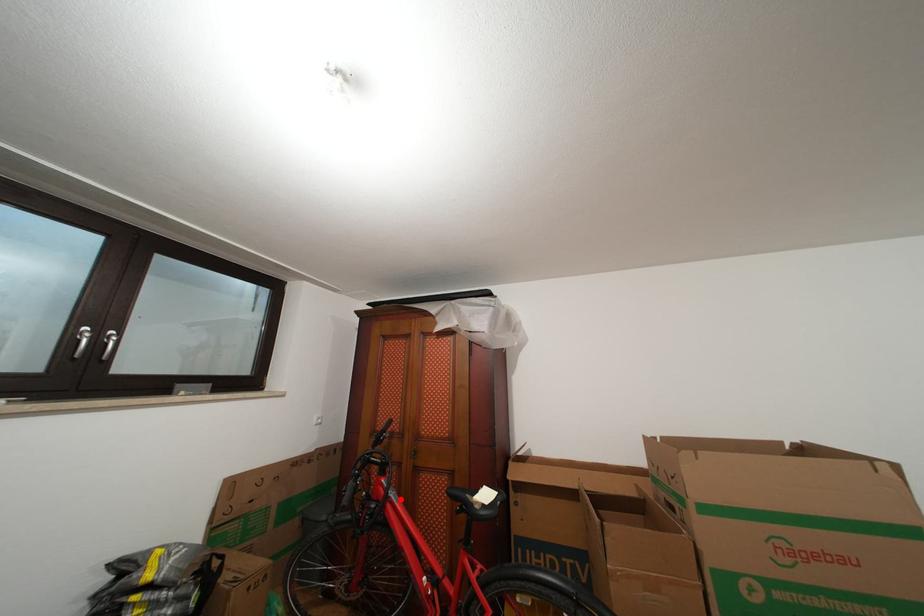
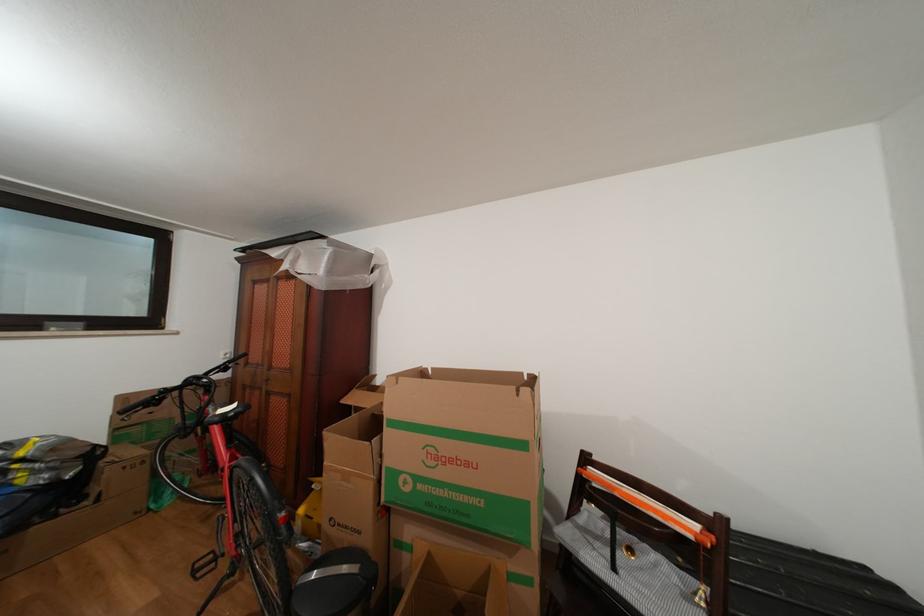
Question: I am providing you with two images of the same scene from different viewpoints. Image1 has a red point marked. In image2, the corresponding 3D location appears at what relative position? Reply with the corresponding letter.

Choices:
 (A) Closer
 (B) Farther

Answer: (B)